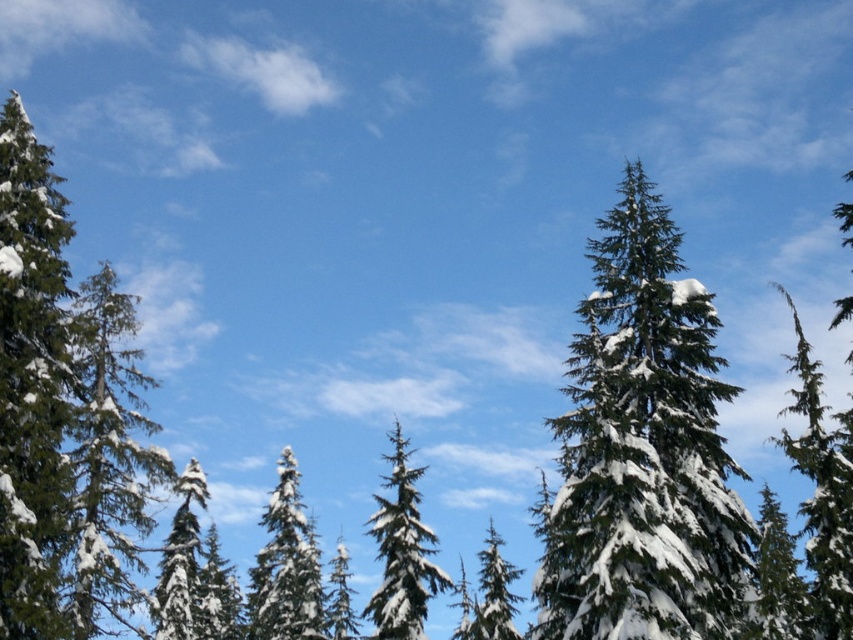
Question: Is white snow-covered tree at center to the left of white snow-covered tree at left from the viewer's perspective?

Choices:
 (A) no
 (B) yes

Answer: (A)

Question: Does green matte evergreen tree at left come behind green textured pine tree at center?

Choices:
 (A) yes
 (B) no

Answer: (B)

Question: Which object is the closest to the snow-covered evergreen at right?

Choices:
 (A) green matte evergreen tree at left
 (B) green textured pine tree at center
 (C) white snow-covered tree at left
 (D) snow-covered pine tree at center

Answer: (C)

Question: Which object is farther from the camera taking this photo?

Choices:
 (A) green textured pine tree at center
 (B) snow-covered evergreen at right
 (C) snow-covered pine tree at center
 (D) white snow-covered tree at center

Answer: (C)

Question: Is snow-covered evergreen at right further to camera compared to white snow-covered tree at left?

Choices:
 (A) no
 (B) yes

Answer: (A)

Question: Which of the following is the farthest from the observer?

Choices:
 (A) (177, 484)
 (B) (134, 492)
 (C) (476, 634)
 (D) (666, 588)

Answer: (A)